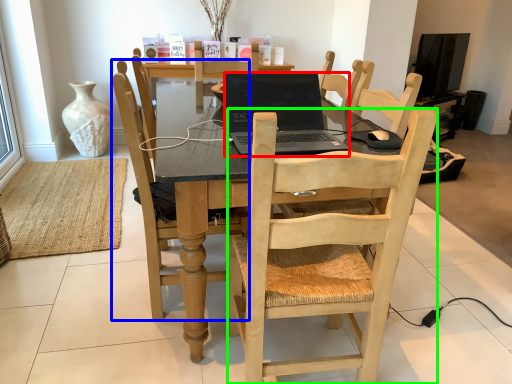
Question: Which object is positioned farthest from laptop (highlighted by a red box)? Select from chair (highlighted by a blue box) and chair (highlighted by a green box).

Choices:
 (A) chair
 (B) chair

Answer: (B)